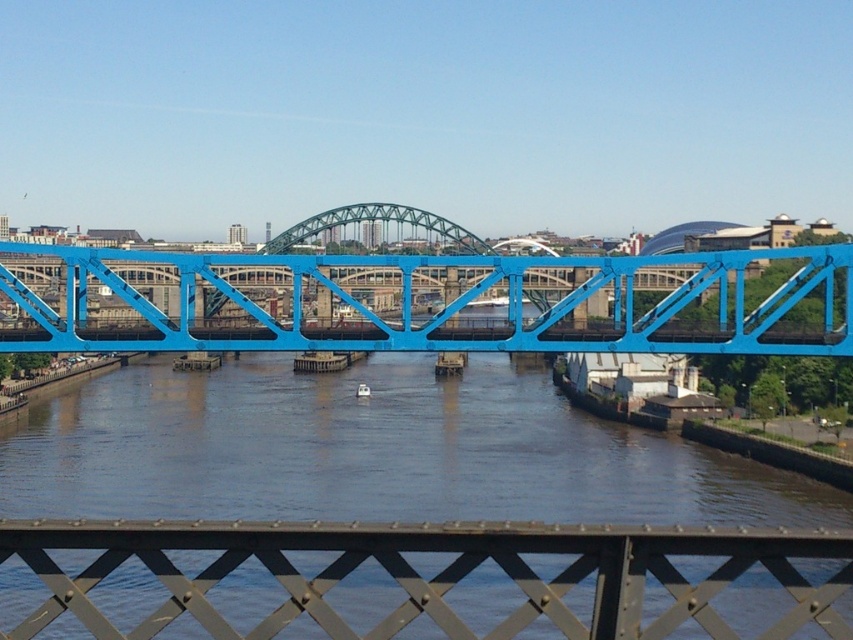
Question: Does blue metallic bridge at center have a greater width compared to metallic gray lattice at center?

Choices:
 (A) yes
 (B) no

Answer: (A)

Question: Which object is closer to the camera taking this photo?

Choices:
 (A) metallic gray lattice at center
 (B) brown matte water at center
 (C) blue metallic bridge at center

Answer: (A)

Question: Considering the real-world distances, which object is closest to the metallic gray lattice at center?

Choices:
 (A) blue metallic bridge at center
 (B) brown matte water at center

Answer: (B)

Question: Is brown matte water at center bigger than metallic gray lattice at center?

Choices:
 (A) yes
 (B) no

Answer: (A)

Question: Is the position of blue metallic bridge at center more distant than that of metallic gray lattice at center?

Choices:
 (A) no
 (B) yes

Answer: (B)

Question: Which object is positioned closest to the blue metallic bridge at center?

Choices:
 (A) brown matte water at center
 (B) metallic gray lattice at center

Answer: (A)